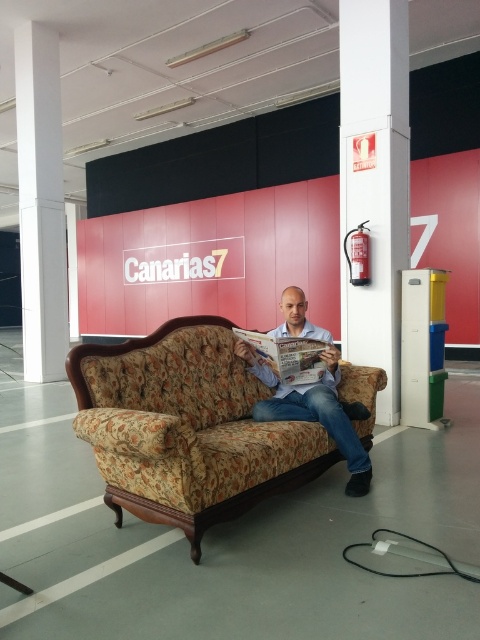
Find the location of a particular element. The image size is (480, 640). floral fabric couch at center is located at coordinates (187, 428).

Does point (355, 385) lie in front of point (393, 177)?

Yes.

The height and width of the screenshot is (640, 480). Identify the location of floral fabric couch at center. [187, 428].

Who is higher up, floral fabric couch at center or white smooth pillar at left?

white smooth pillar at left is above.

Between floral fabric couch at center and white smooth pillar at left, which one appears on the right side from the viewer's perspective?

Positioned to the right is floral fabric couch at center.

Is point (216, 372) behind point (23, 65)?

That is False.

Identify the location of floral fabric couch at center. (187, 428).

Is white glossy fire extinguisher at right thinner than white smooth pillar at left?

Indeed, white glossy fire extinguisher at right has a lesser width compared to white smooth pillar at left.

Find the location of a particular element. white glossy fire extinguisher at right is located at coordinates (374, 180).